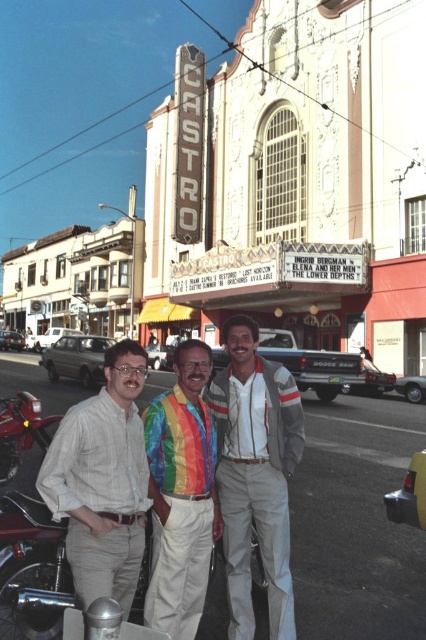
Question: Does rainbow fabric shirt at center have a smaller size compared to shiny red motorcycle at lower left?

Choices:
 (A) no
 (B) yes

Answer: (B)

Question: Which object is the farthest from the shiny red motorcycle at lower left?

Choices:
 (A) light beige shirt at center
 (B) rainbow tie at center

Answer: (B)

Question: Which point is farther to the camera?

Choices:
 (A) rainbow tie at center
 (B) rainbow fabric shirt at center
 (C) shiny red motorcycle at lower left
 (D) light beige shirt at center

Answer: (C)

Question: From the image, what is the correct spatial relationship of light beige shirt at center in relation to shiny red motorcycle at lower left?

Choices:
 (A) right
 (B) left

Answer: (A)

Question: Which object appears farthest from the camera in this image?

Choices:
 (A) rainbow tie at center
 (B) light beige shirt at center

Answer: (A)

Question: Can you confirm if rainbow tie at center is positioned below shiny red motorcycle at lower left?

Choices:
 (A) no
 (B) yes

Answer: (A)